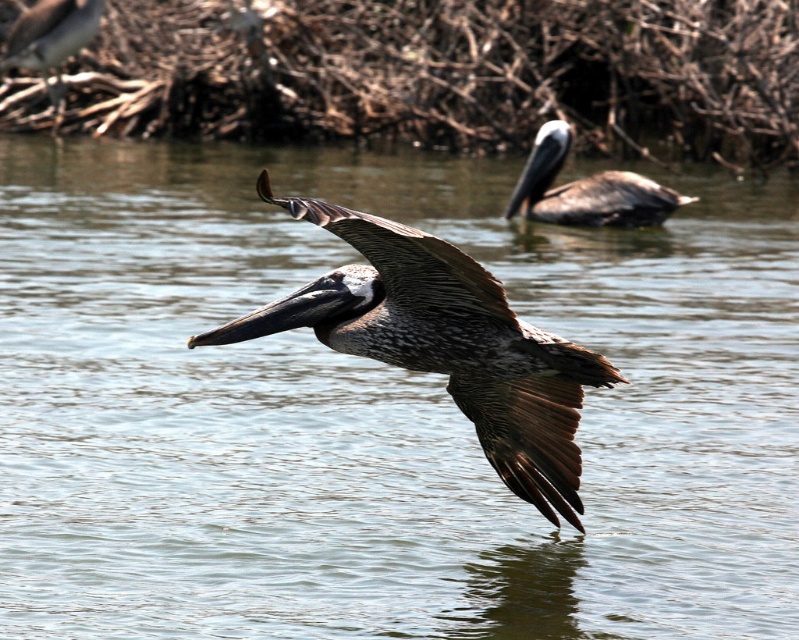
Who is more forward, (472, 356) or (539, 211)?

Point (472, 356) is more forward.

Does brown feathered pelican at center appear on the right side of brown feathered pelican at upper right?

No, brown feathered pelican at center is not to the right of brown feathered pelican at upper right.

Where is `brown feathered pelican at center`? The width and height of the screenshot is (799, 640). brown feathered pelican at center is located at coordinates (444, 342).

Where is `brown feathered pelican at center`? This screenshot has height=640, width=799. brown feathered pelican at center is located at coordinates (444, 342).